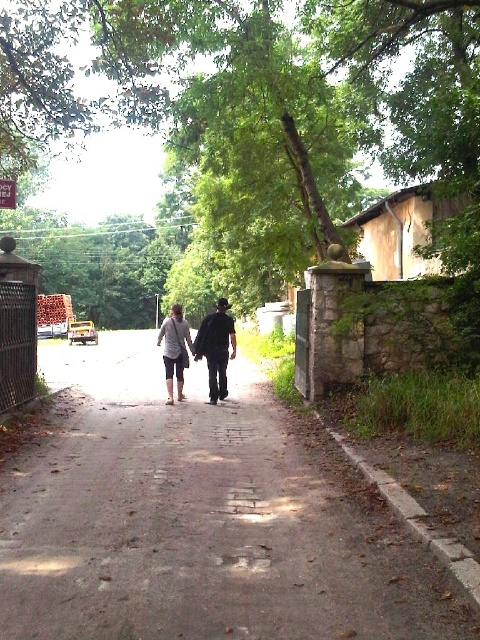
Which is in front, point (46, 368) or point (168, 374)?

Point (168, 374) is in front.

Is dull gray concrete path at center above light gray cotton shorts at center?

Incorrect, dull gray concrete path at center is not positioned above light gray cotton shorts at center.

Which is behind, point (361, 586) or point (167, 387)?

The point (167, 387) is behind.

The image size is (480, 640). In order to click on dull gray concrete path at center in this screenshot , I will do `click(199, 516)`.

Who is taller, dark gray fabric pants at center or light gray cotton shorts at center?

Standing taller between the two is dark gray fabric pants at center.

Does dark gray fabric pants at center have a lesser width compared to light gray cotton shorts at center?

No, dark gray fabric pants at center is not thinner than light gray cotton shorts at center.

Identify the location of dark gray fabric pants at center. (216, 348).

Locate an element on the screen. Image resolution: width=480 pixels, height=640 pixels. dark gray fabric pants at center is located at coordinates (216, 348).

Does dull gray concrete path at center appear on the left side of dark gray fabric pants at center?

Indeed, dull gray concrete path at center is positioned on the left side of dark gray fabric pants at center.

Does point (61, 561) come closer to viewer compared to point (229, 355)?

Yes, point (61, 561) is closer to viewer.

Where is `dull gray concrete path at center`? Image resolution: width=480 pixels, height=640 pixels. dull gray concrete path at center is located at coordinates (199, 516).